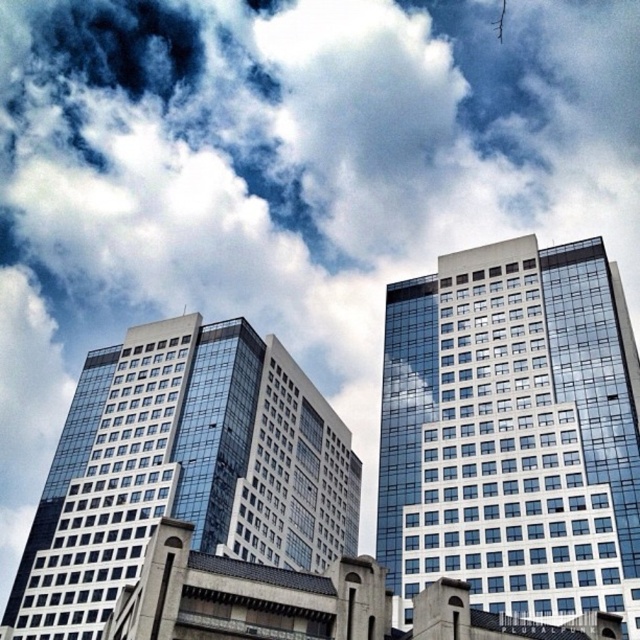
Question: Which object is farther from the camera taking this photo?

Choices:
 (A) glassy reflective building at upper center
 (B) glassy reflective building at center

Answer: (B)

Question: In this image, where is glassy reflective building at upper center located relative to glassy reflective building at center?

Choices:
 (A) right
 (B) left

Answer: (A)

Question: Where is glassy reflective building at upper center located in relation to glassy reflective building at center in the image?

Choices:
 (A) left
 (B) right

Answer: (B)

Question: Among these points, which one is nearest to the camera?

Choices:
 (A) (280, 449)
 (B) (627, 509)

Answer: (B)

Question: Is glassy reflective building at upper center positioned at the back of glassy reflective building at center?

Choices:
 (A) no
 (B) yes

Answer: (A)

Question: Which object appears closest to the camera in this image?

Choices:
 (A) glassy reflective building at center
 (B) glassy reflective building at upper center

Answer: (B)